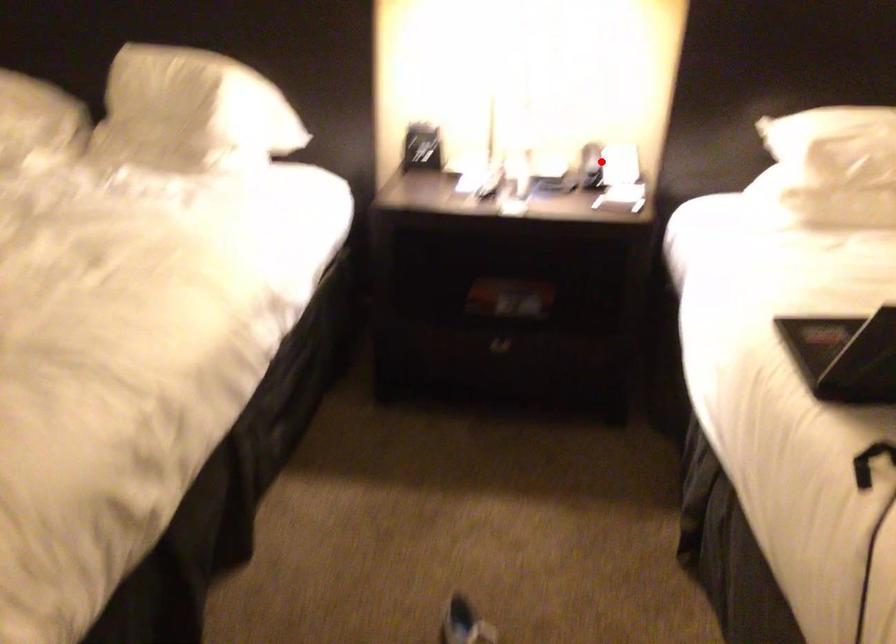
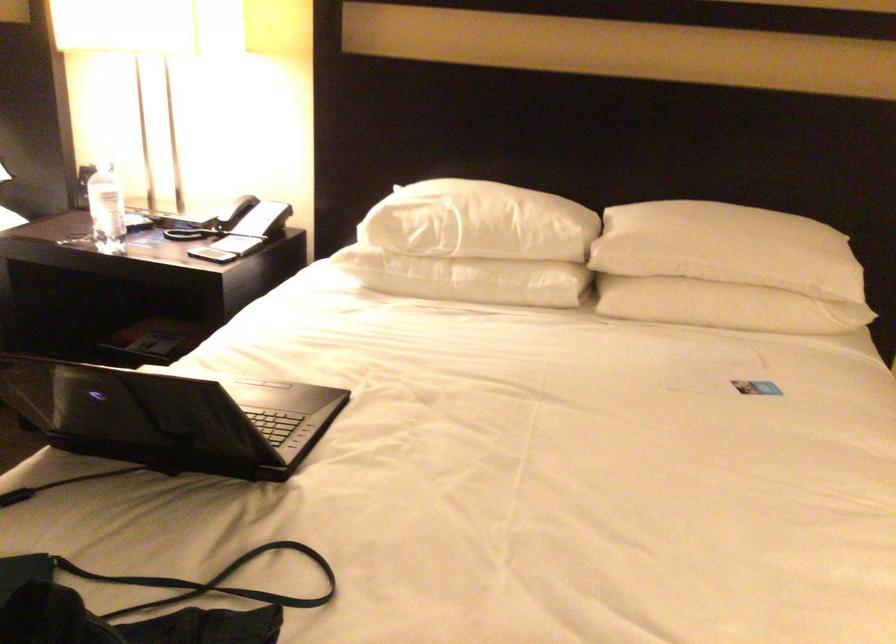
In the second image, find the point that corresponds to the highlighted location in the first image.

(238, 221)